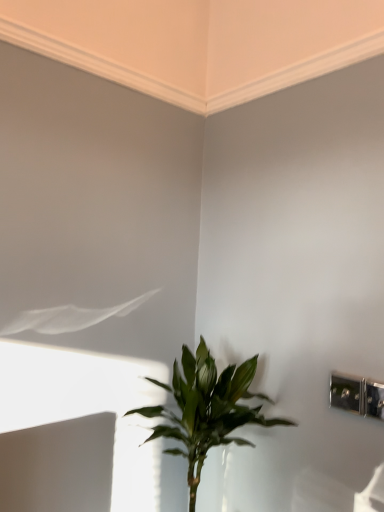
Image resolution: width=384 pixels, height=512 pixels. What do you see at coordinates (206, 409) in the screenshot?
I see `green glossy plant at center` at bounding box center [206, 409].

The height and width of the screenshot is (512, 384). I want to click on green glossy plant at center, so click(206, 409).

This screenshot has height=512, width=384. Find the location of `green glossy plant at center`. green glossy plant at center is located at coordinates (206, 409).